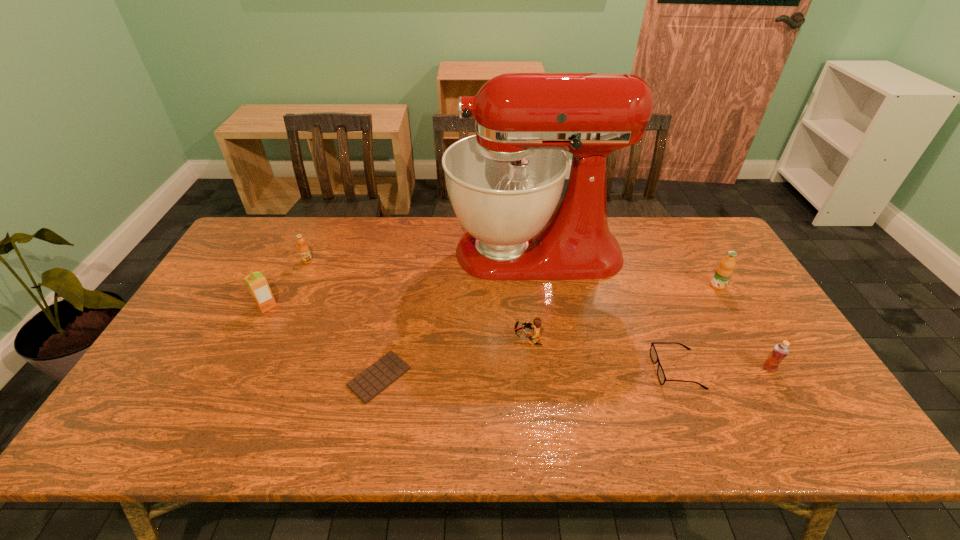
This screenshot has height=540, width=960. In order to click on mixer in this screenshot , I will do `click(504, 183)`.

Find the location of a particular element. The height and width of the screenshot is (540, 960). the second farthest orange juice is located at coordinates (723, 272).

Image resolution: width=960 pixels, height=540 pixels. Find the location of `the leftmost object`. the leftmost object is located at coordinates (256, 282).

Identify the location of the fifth nearest object. This screenshot has height=540, width=960. (256, 282).

I want to click on the third orange juice from right to left, so click(303, 249).

Where is `the seventh object from right to left`? Image resolution: width=960 pixels, height=540 pixels. the seventh object from right to left is located at coordinates (303, 249).

The width and height of the screenshot is (960, 540). I want to click on the nearest orange juice, so click(781, 350).

Where is `Lego`? Image resolution: width=960 pixels, height=540 pixels. Lego is located at coordinates (537, 322).

You are a GUI agent. You are given a task and a screenshot of the screen. Output one action in this format:
    pyautogui.click(x=<x>, y=<y>)
    Task: Click on the spectacles
    
    Given the screenshot: What is the action you would take?
    pyautogui.click(x=653, y=353)

At what (x,y) coordinates should I click in order to perform the action: click on the shortest object. Please return your answer as a coordinate pair (x, y). The image size is (960, 540). Looking at the image, I should click on (368, 384).